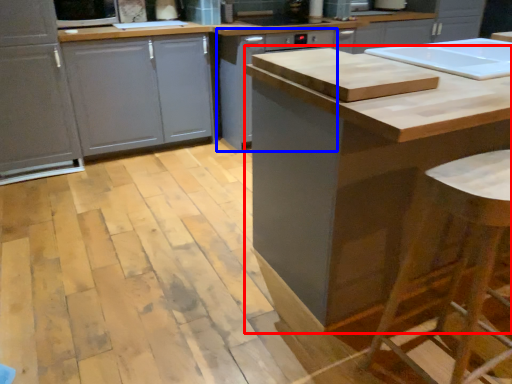
Question: Which of the following is the farthest to the observer, cabinetry (highlighted by a red box) or cabinetry (highlighted by a blue box)?

Choices:
 (A) cabinetry
 (B) cabinetry

Answer: (B)